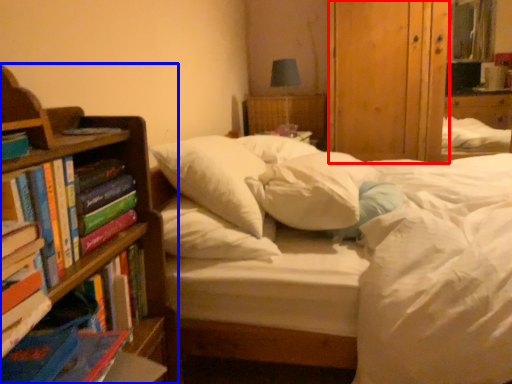
Question: Which of the following is the farthest to the observer, armoire (highlighted by a red box) or bookcase (highlighted by a blue box)?

Choices:
 (A) armoire
 (B) bookcase

Answer: (A)